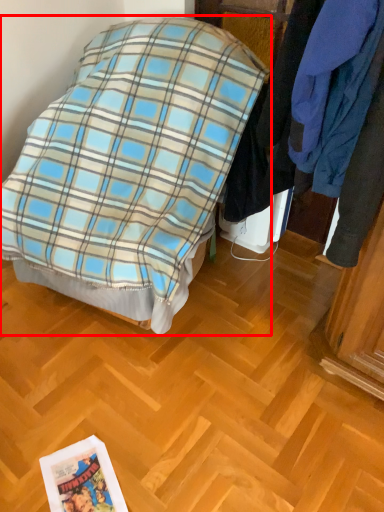
Question: Considering the relative positions of bed (annotated by the red box) and closet in the image provided, where is bed (annotated by the red box) located with respect to the staircase?

Choices:
 (A) left
 (B) right

Answer: (A)